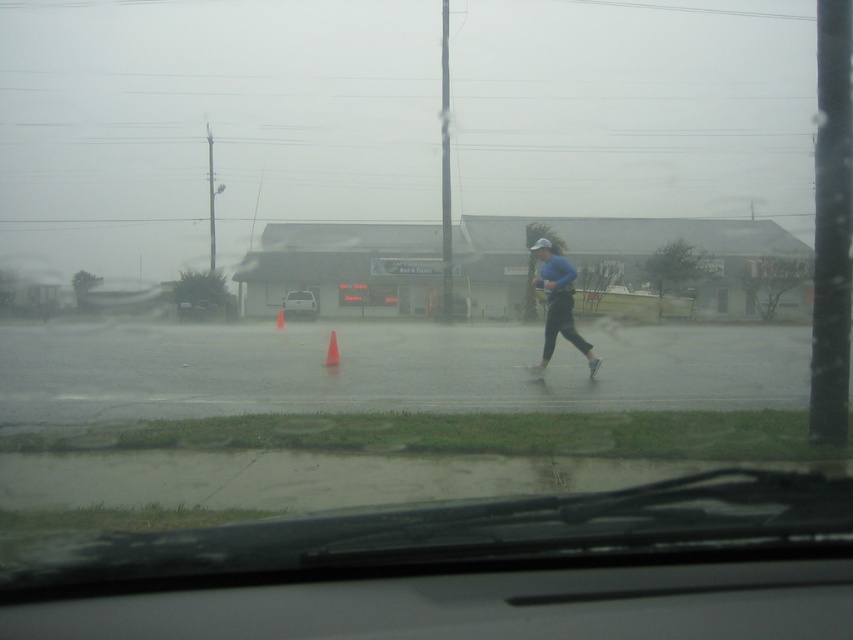
You are driving a car and see the white matte car at center and the orange plastic cone at center in the road ahead. Which object is wider? Please answer based on their widths.

The white matte car at center is wider than the orange plastic cone at center because its width surpasses the cone.

You are a passenger in the white matte car at center. You notice an orange plastic cone at center on the road ahead. Can you safely drive around it without crossing the road?

The white matte car at center is located above the orange plastic cone at center, which means the cone is positioned below the car in the image. Since the car is already positioned above the cone, it might already be past it or in a position where driving forward could avoid the cone without crossing the road. However, without knowing the exact distance or road layout, it is safer to proceed cautiously and ensure there is enough space to maneuver around the cone while staying within your lane.

You are a driver trying to navigate through the rain. You see a blue matte running suit at center and an orange plastic cone at center on the road. Which object would appear closer to you based on their sizes?

The blue matte running suit at center appears closer because it is larger in size than the orange plastic cone at center.